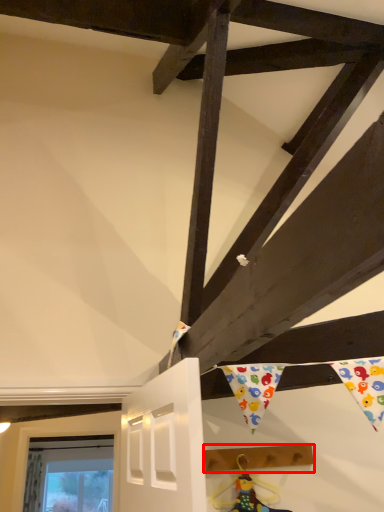
Question: From the image, what is the correct spatial relationship of plank (annotated by the red box) in relation to doll?

Choices:
 (A) right
 (B) left

Answer: (A)